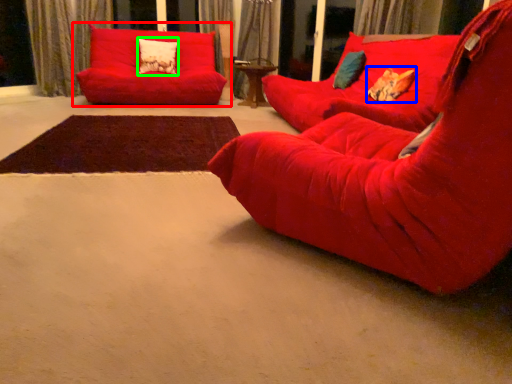
Question: Which object is the farthest from studio couch (highlighted by a red box)? Choose among these: pillow (highlighted by a blue box) or pillow (highlighted by a green box).

Choices:
 (A) pillow
 (B) pillow

Answer: (A)